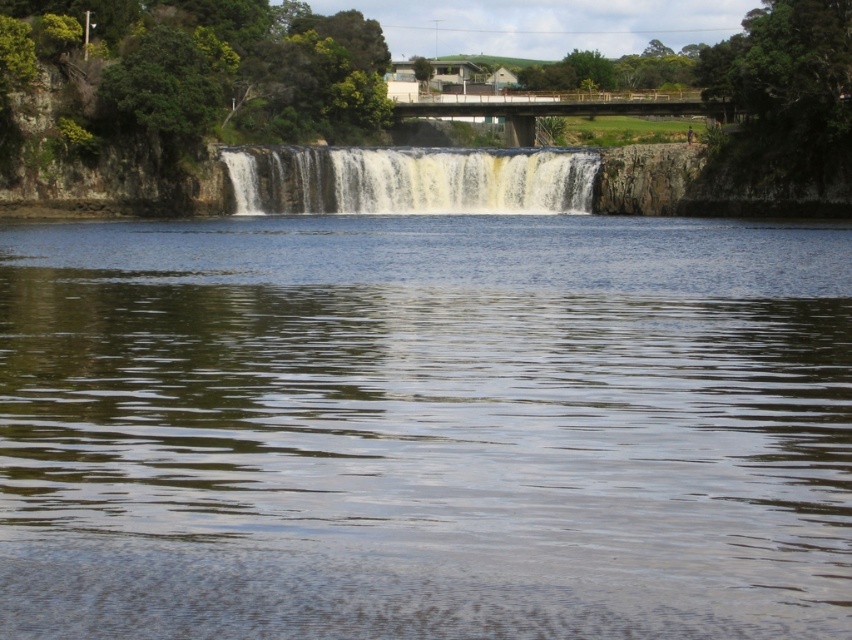
Is greenish reflective water at center thinner than white frothy water at center?

No.

Which is more to the left, greenish reflective water at center or white frothy water at center?

white frothy water at center

Which is behind, point (626, 460) or point (263, 195)?

Positioned behind is point (263, 195).

The width and height of the screenshot is (852, 640). What are the coordinates of `greenish reflective water at center` in the screenshot? It's located at (426, 428).